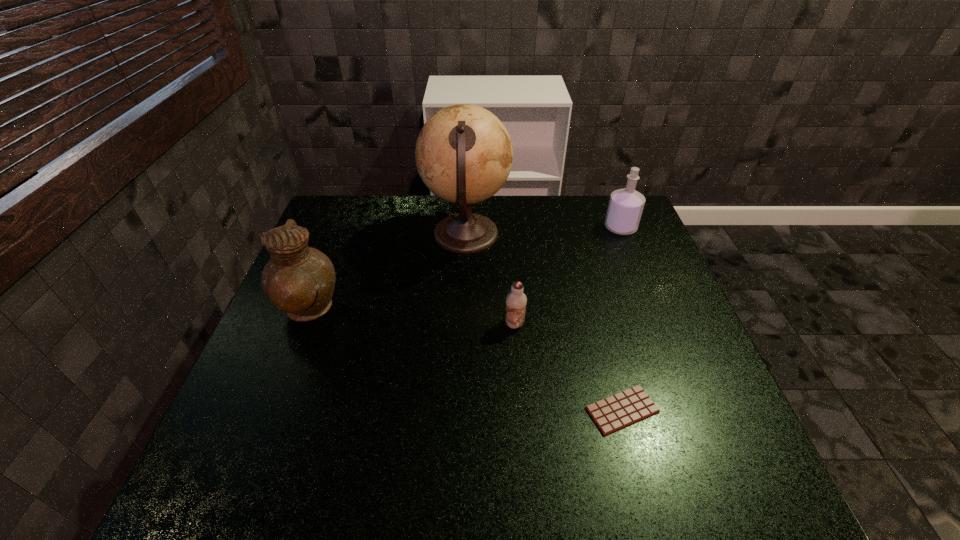
Identify the location of vacant space that is in between the candy bar and the tallest object. (544, 322).

You are a GUI agent. You are given a task and a screenshot of the screen. Output one action in this format:
    pyautogui.click(x=<x>, y=<y>)
    Task: Click on the free space between the second shortest object and the perfume
    
    Given the screenshot: What is the action you would take?
    pyautogui.click(x=567, y=276)

You are a GUI agent. You are given a task and a screenshot of the screen. Output one action in this format:
    pyautogui.click(x=<x>, y=<y>)
    Task: Click on the vacant space that's between the candy bar and the tallest object
    
    Given the screenshot: What is the action you would take?
    pyautogui.click(x=544, y=322)

Locate an element on the screen. blank region between the rightmost object and the fourth shortest object is located at coordinates (464, 269).

Find the location of a particular element. vacant space in between the third shortest object and the candy bar is located at coordinates (621, 319).

Identify which object is the third closest to the chocolate milk. Please provide its 2D coordinates. Your answer should be formatted as a tuple, i.e. [(x, y)], where the tuple contains the x and y coordinates of a point satisfying the conditions above.

[(299, 280)]

Where is `object that ranks as the fourth closest to the rightmost object`? The image size is (960, 540). object that ranks as the fourth closest to the rightmost object is located at coordinates (299, 280).

Locate an element on the screen. The width and height of the screenshot is (960, 540). vacant area that satisfies the following two spatial constraints: 1. on the front-facing side of the tallest object; 2. on the left side of the fourth tallest object is located at coordinates (463, 324).

Identify the location of free spot that satisfies the following two spatial constraints: 1. on the front side of the fourth tallest object; 2. on the right side of the second object from right to left. tap(521, 410).

Locate an element on the screen. This screenshot has width=960, height=540. vacant region that satisfies the following two spatial constraints: 1. at the spout of the second tallest object; 2. on the right side of the second shortest object is located at coordinates (302, 324).